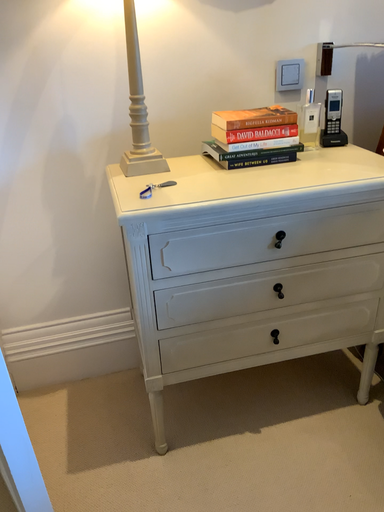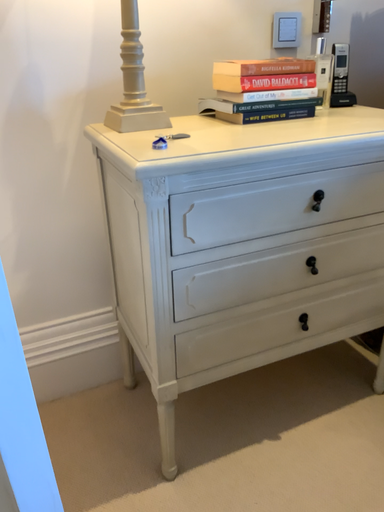
Question: How did the camera likely rotate when shooting the video?

Choices:
 (A) rotated left
 (B) rotated right

Answer: (B)